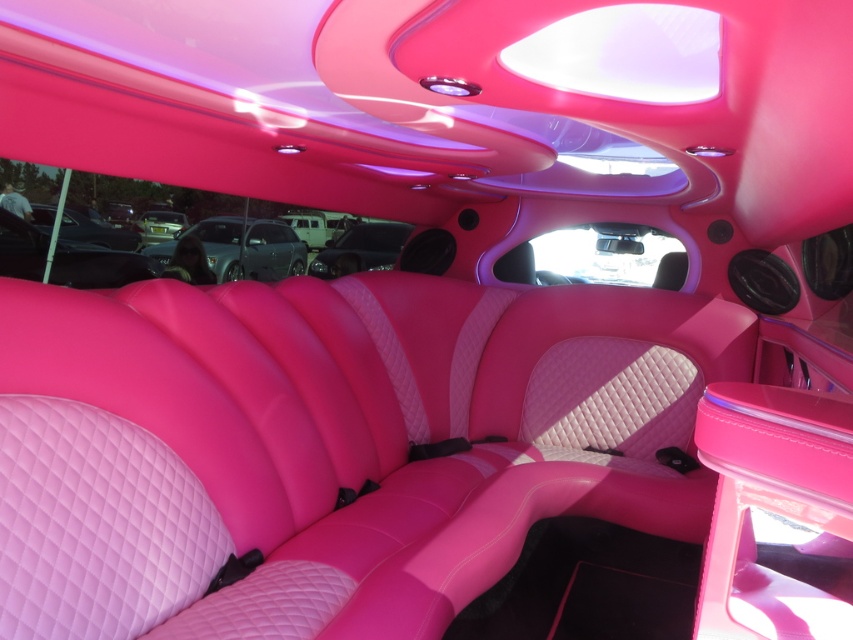
You are a car designer evaluating two cars in the showroom. You see a matte pink leather car at center and a glossy metallic car at center. Which car do you think has a wider body?

The matte pink leather car at center might be wider than glossy metallic car at center according to the description.

You are standing in the vehicle and want to reach the point at coordinates (254, 241). Considering the vehicle has a length of 15 feet, can you safely reach that point without exceeding the vehicle length?

The point at coordinates (254, 241) is 25.74 feet away from the viewer, which exceeds the vehicle length of 15 feet. Therefore, you cannot safely reach that point without exceeding the vehicle length.

Consider the image. You are a passenger sitting in the back of the car. You want to look at both the matte pink leather car at center and the glossy metallic car at center. Which one will you see first when looking forward?

Result: The matte pink leather car at center is further to the viewer than the glossy metallic car at center, so you will see the matte pink leather car at center first when looking forward.